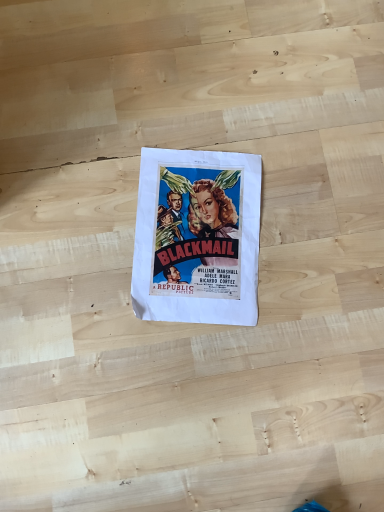
At what (x,y) coordinates should I click in order to perform the action: click on matte paper poster at center. Please return your answer as a coordinate pair (x, y). Image resolution: width=384 pixels, height=512 pixels. Looking at the image, I should click on (197, 237).

What is the approximate height of matte paper poster at center?

The height of matte paper poster at center is 0.47 inches.

This screenshot has width=384, height=512. What do you see at coordinates (197, 237) in the screenshot?
I see `matte paper poster at center` at bounding box center [197, 237].

You are a GUI agent. You are given a task and a screenshot of the screen. Output one action in this format:
    pyautogui.click(x=<x>, y=<y>)
    Task: Click on the matte paper poster at center
    
    Given the screenshot: What is the action you would take?
    pyautogui.click(x=197, y=237)